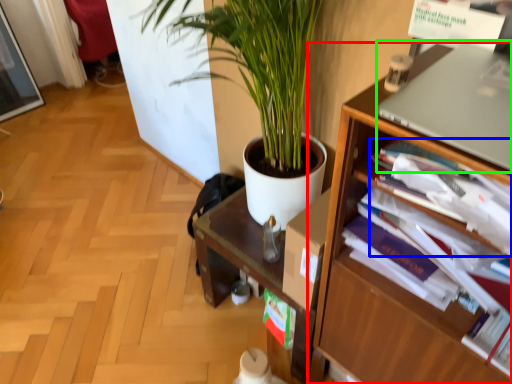
Question: Which is nearer to the shelf (highlighted by a red box)? magazine (highlighted by a blue box) or computer (highlighted by a green box).

Choices:
 (A) magazine
 (B) computer

Answer: (A)